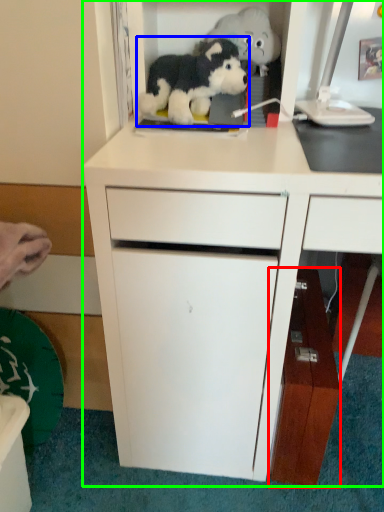
Question: Estimate the real-world distances between objects in this image. Which object is closer to cabinetry (highlighted by a red box), toy (highlighted by a blue box) or cabinetry (highlighted by a green box)?

Choices:
 (A) toy
 (B) cabinetry

Answer: (B)